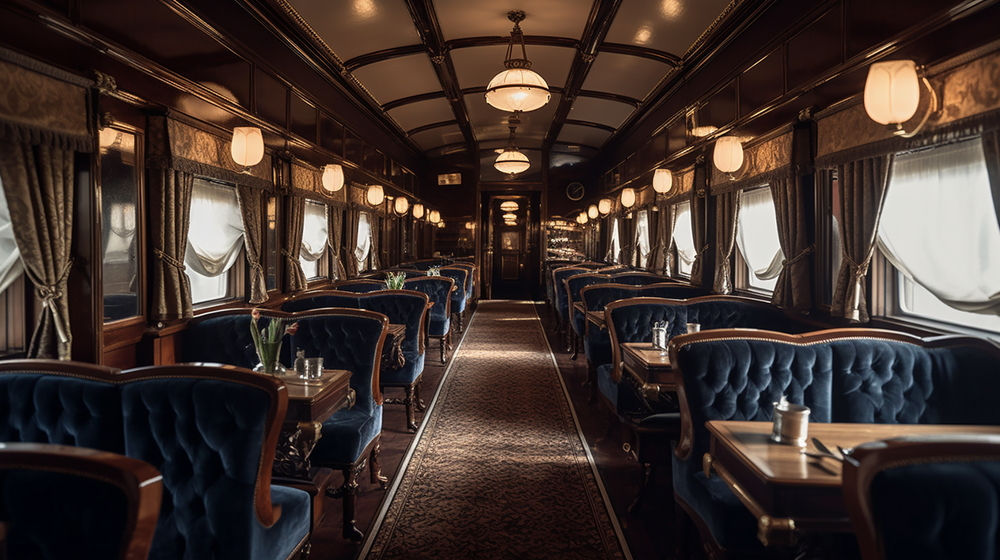
What are the coordinates of `window` in the screenshot? It's located at (216, 236), (13, 286), (309, 248), (362, 265), (905, 296), (753, 280), (678, 267), (643, 260).